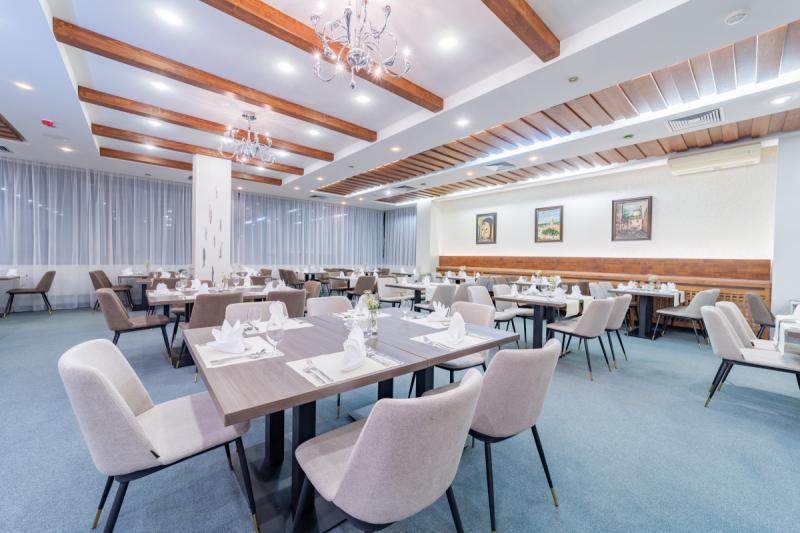
Identify the location of wooden beam. This screenshot has height=533, width=800. (532, 39), (416, 95), (348, 126), (305, 149), (285, 166), (266, 177).